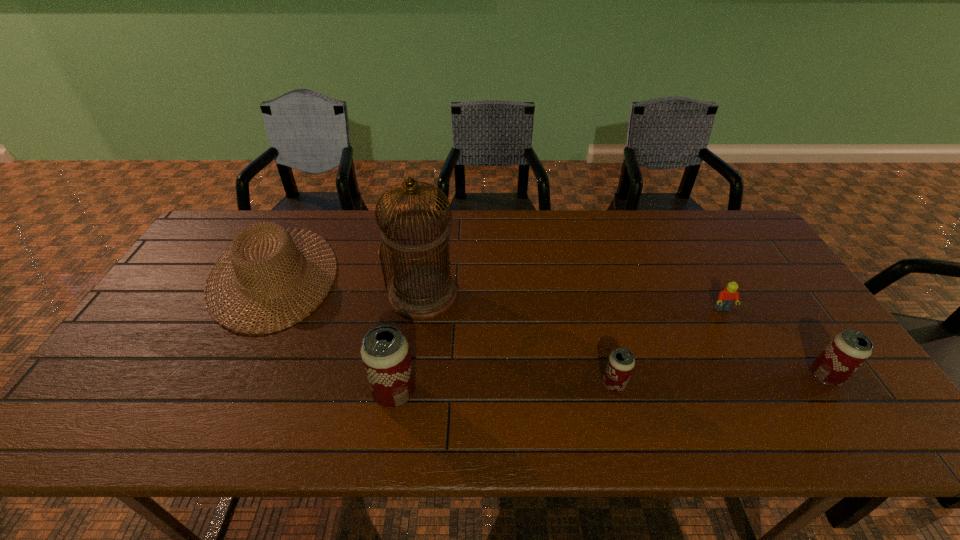
The width and height of the screenshot is (960, 540). What are the coordinates of `free space at the far edge of the desktop` in the screenshot? It's located at (416, 226).

Find the location of `vacant space at the near edge of the desktop`. vacant space at the near edge of the desktop is located at coordinates (230, 388).

The height and width of the screenshot is (540, 960). In the image, there is a desktop. Find the location of `vacant region at the left edge`. vacant region at the left edge is located at coordinates (185, 281).

Identify the location of vacant space at the far right corner. Image resolution: width=960 pixels, height=540 pixels. (722, 238).

This screenshot has width=960, height=540. In order to click on free space at the near right corner of the desktop in this screenshot , I will do `click(852, 376)`.

This screenshot has height=540, width=960. Find the location of `free space between the tallest object and the tallest beer can`. free space between the tallest object and the tallest beer can is located at coordinates (409, 343).

Locate an element on the screen. This screenshot has width=960, height=540. vacant area that lies between the tallest beer can and the third object from right to left is located at coordinates (504, 388).

You are a GUI agent. You are given a task and a screenshot of the screen. Output one action in this format:
    pyautogui.click(x=<x>, y=<y>)
    Task: Click on the free space between the second object from right to left and the sunhat
    
    Given the screenshot: What is the action you would take?
    pyautogui.click(x=497, y=292)

The image size is (960, 540). What are the coordinates of `free space between the birdcage and the second tallest beer can` in the screenshot? It's located at click(x=625, y=335).

You are a GUI agent. You are given a task and a screenshot of the screen. Output one action in this format:
    pyautogui.click(x=<x>, y=<y>)
    Task: Click on the empty space that is in between the tallest beer can and the leftmost object
    The height and width of the screenshot is (540, 960).
    Given the screenshot: What is the action you would take?
    pyautogui.click(x=334, y=334)